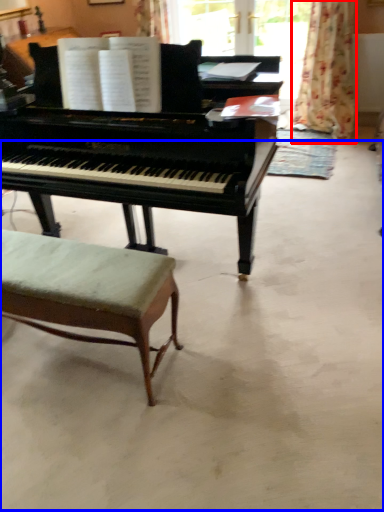
Question: Which of the following is the closest to the observer, curtain (highlighted by a red box) or concrete (highlighted by a blue box)?

Choices:
 (A) curtain
 (B) concrete

Answer: (B)